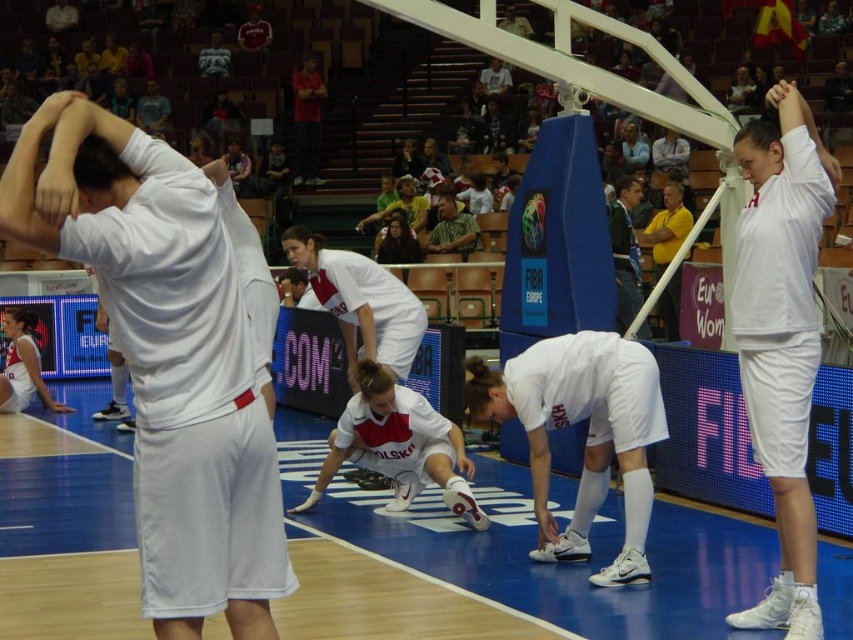
Question: Among these objects, which one is nearest to the camera?

Choices:
 (A) green plaid shirt at center
 (B) green fabric jacket at upper center
 (C) blue rubber basketball court at center
 (D) white matte uniform at center

Answer: (C)

Question: Which object is closer to the camera taking this photo?

Choices:
 (A) blue rubber basketball court at center
 (B) white matte uniform at center
 (C) white matte shorts at center
 (D) green plaid shirt at center

Answer: (C)

Question: Is the position of white matte shorts at center less distant than that of green plaid shirt at center?

Choices:
 (A) yes
 (B) no

Answer: (A)

Question: Based on their relative distances, which object is nearer to the green plaid shirt at center?

Choices:
 (A) blue rubber basketball court at center
 (B) white matte uniform at center
 (C) green fabric jacket at upper center
 (D) white matte shorts at center

Answer: (C)

Question: Can you confirm if blue rubber basketball court at center is bigger than green fabric jacket at upper center?

Choices:
 (A) yes
 (B) no

Answer: (A)

Question: From the image, what is the correct spatial relationship of white matte shorts at center in relation to green plaid shirt at center?

Choices:
 (A) below
 (B) above

Answer: (A)